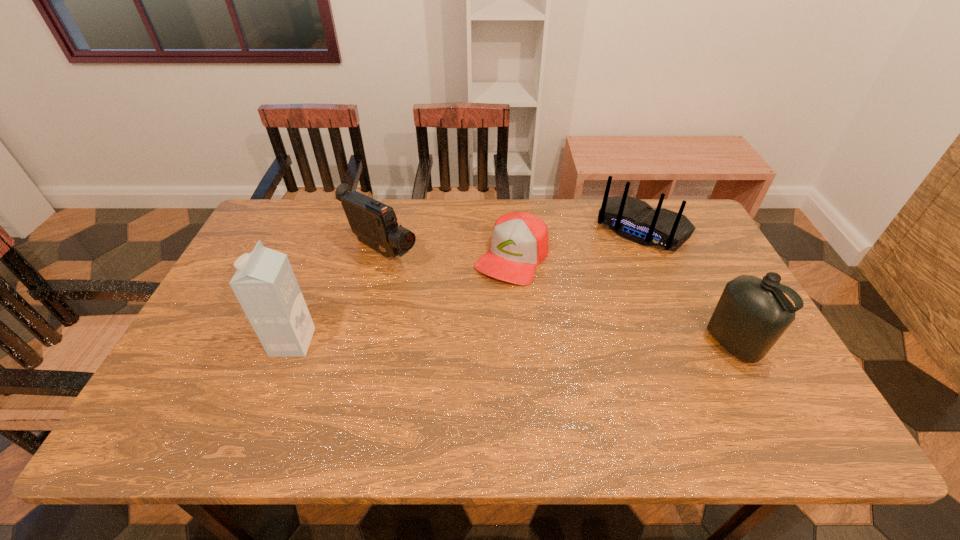
Where is `vacant area that lies between the fourth shortest object and the carton`? vacant area that lies between the fourth shortest object and the carton is located at coordinates (513, 343).

Locate an element on the screen. The height and width of the screenshot is (540, 960). object that stands as the second closest to the baseball cap is located at coordinates (635, 220).

Choose which object is the second nearest neighbor to the camcorder. Please provide its 2D coordinates. Your answer should be formatted as a tuple, i.e. [(x, y)], where the tuple contains the x and y coordinates of a point satisfying the conditions above.

[(265, 285)]

The height and width of the screenshot is (540, 960). Identify the location of free space in the image that satisfies the following two spatial constraints: 1. on the front side of the camcorder; 2. on the right side of the shortest object. tap(379, 256).

Where is `blank space that satisfies the following two spatial constraints: 1. on the front side of the router; 2. on the right side of the bottle`? The width and height of the screenshot is (960, 540). blank space that satisfies the following two spatial constraints: 1. on the front side of the router; 2. on the right side of the bottle is located at coordinates (691, 344).